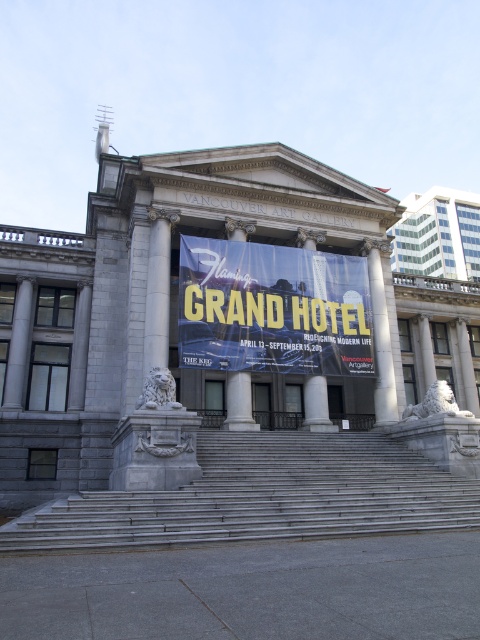
Between blue fabric banner at center and white marble pillar at center, which one has less height?

blue fabric banner at center

Is the position of blue fabric banner at center less distant than that of white marble pillar at center?

Yes, it is.

Is point (292, 294) closer to viewer compared to point (371, 246)?

Yes, it is in front of point (371, 246).

Locate an element on the screen. blue fabric banner at center is located at coordinates (273, 308).

Who is higher up, gray stone stairs at center or white marble pillar at center?

white marble pillar at center

Can you confirm if gray stone stairs at center is bigger than white marble pillar at center?

Yes, gray stone stairs at center is bigger than white marble pillar at center.

Is point (170, 544) positioned behind point (375, 264)?

That is False.

This screenshot has height=640, width=480. In order to click on gray stone stairs at center in this screenshot , I will do point(264,497).

Is gray stone stairs at center to the left of gray stone column at center from the viewer's perspective?

Indeed, gray stone stairs at center is positioned on the left side of gray stone column at center.

Is point (259, 484) positioned before point (425, 349)?

Yes, point (259, 484) is closer to viewer.

Who is more forward, (325, 525) or (428, 323)?

Point (325, 525) is in front.

I want to click on gray stone stairs at center, so click(x=264, y=497).